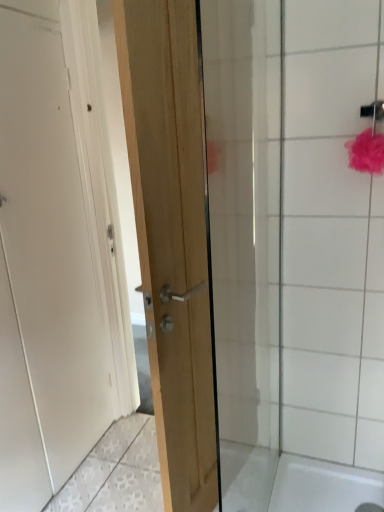
At what (x,y) coordinates should I click in order to perform the action: click on natural wood door at center, which ranks as the second door in left-to-right order. Please return your answer as a coordinate pair (x, y). The width and height of the screenshot is (384, 512). Looking at the image, I should click on (172, 234).

At what (x,y) coordinates should I click in order to perform the action: click on white matte door at left, the second door viewed from the right. Please return your answer as a coordinate pair (x, y). This screenshot has width=384, height=512. Looking at the image, I should click on (56, 234).

This screenshot has height=512, width=384. What do you see at coordinates (271, 260) in the screenshot?
I see `white glossy shower door at upper right` at bounding box center [271, 260].

You are a GUI agent. You are given a task and a screenshot of the screen. Output one action in this format:
    pyautogui.click(x=<x>, y=<y>)
    Task: Click on the natural wood door at center, marked as the 1th door in a right-to-left arrangement
    The width and height of the screenshot is (384, 512).
    Given the screenshot: What is the action you would take?
    pyautogui.click(x=172, y=234)

Is white glossy shower door at upper right positioned in front of natural wood door at center, which ranks as the second door in left-to-right order?

No, white glossy shower door at upper right is behind natural wood door at center, which ranks as the second door in left-to-right order.

The height and width of the screenshot is (512, 384). In order to click on shower door behind the natural wood door at center, which ranks as the second door in left-to-right order in this screenshot , I will do `click(271, 260)`.

Is point (313, 106) closer to camera compared to point (201, 69)?

No, (313, 106) is further to viewer.

Is white matte door at left, the second door viewed from the right, positioned with its back to white glossy shower door at upper right?

white matte door at left, the second door viewed from the right, is not turned away from white glossy shower door at upper right.

From the image's perspective, is white matte door at left, the 1th door from the left, located above or below white glossy shower door at upper right?

white matte door at left, the 1th door from the left, is situated higher than white glossy shower door at upper right in the image.

Between white matte door at left, the second door viewed from the right, and white glossy shower door at upper right, which one has smaller size?

white glossy shower door at upper right is smaller.

Can you confirm if white matte door at left, the second door viewed from the right, is positioned to the right of white glossy shower door at upper right?

No.

Could you tell me if natural wood door at center, which ranks as the second door in left-to-right order, is facing white matte door at left, the 1th door from the left?

Yes, natural wood door at center, which ranks as the second door in left-to-right order, is aimed at white matte door at left, the 1th door from the left.

The height and width of the screenshot is (512, 384). I want to click on door above the natural wood door at center, marked as the 1th door in a right-to-left arrangement (from the image's perspective), so click(x=56, y=234).

Considering the sizes of natural wood door at center, which ranks as the second door in left-to-right order, and white matte door at left, the 1th door from the left, in the image, is natural wood door at center, which ranks as the second door in left-to-right order, taller or shorter than white matte door at left, the 1th door from the left,?

In the image, natural wood door at center, which ranks as the second door in left-to-right order, appears to be shorter than white matte door at left, the 1th door from the left.

Which of these two, natural wood door at center, which ranks as the second door in left-to-right order, or white glossy shower door at upper right, is bigger?

natural wood door at center, which ranks as the second door in left-to-right order, is bigger.

Considering the sizes of natural wood door at center, which ranks as the second door in left-to-right order, and white glossy shower door at upper right in the image, is natural wood door at center, which ranks as the second door in left-to-right order, taller or shorter than white glossy shower door at upper right?

Considering their sizes, natural wood door at center, which ranks as the second door in left-to-right order, has more height than white glossy shower door at upper right.

Can you tell me how much natural wood door at center, which ranks as the second door in left-to-right order, and white glossy shower door at upper right differ in facing direction?

They differ by 99.9 degrees in their facing directions.

Is natural wood door at center, which ranks as the second door in left-to-right order, positioned beyond the bounds of white glossy shower door at upper right?

Absolutely, natural wood door at center, which ranks as the second door in left-to-right order, is external to white glossy shower door at upper right.

Is white matte door at left, the second door viewed from the right, looking in the opposite direction of natural wood door at center, which ranks as the second door in left-to-right order?

Absolutely, white matte door at left, the second door viewed from the right, is directed away from natural wood door at center, which ranks as the second door in left-to-right order.

In the image, is white matte door at left, the 1th door from the left, positioned in front of or behind natural wood door at center, marked as the 1th door in a right-to-left arrangement?

white matte door at left, the 1th door from the left, is behind natural wood door at center, marked as the 1th door in a right-to-left arrangement.

Can you confirm if white matte door at left, the second door viewed from the right, is smaller than natural wood door at center, marked as the 1th door in a right-to-left arrangement?

Incorrect, white matte door at left, the second door viewed from the right, is not smaller in size than natural wood door at center, marked as the 1th door in a right-to-left arrangement.

Is white matte door at left, the second door viewed from the right, taller or shorter than natural wood door at center, marked as the 1th door in a right-to-left arrangement?

white matte door at left, the second door viewed from the right, is taller than natural wood door at center, marked as the 1th door in a right-to-left arrangement.

Between white glossy shower door at upper right and white matte door at left, the 1th door from the left, which one has less height?

white glossy shower door at upper right is shorter.

Would you say white glossy shower door at upper right is a long distance from white matte door at left, the second door viewed from the right?

They are positioned close to each other.

Between point (267, 231) and point (97, 276), which one is positioned behind?

The point (97, 276) is more distant.

Is white glossy shower door at upper right aimed at white matte door at left, the 1th door from the left?

No, white glossy shower door at upper right is not turned towards white matte door at left, the 1th door from the left.

Starting from the white glossy shower door at upper right, which door is the 2nd one in front? Please provide its 2D coordinates.

[(172, 234)]

Locate an element on the screen. The image size is (384, 512). shower door on the right of white matte door at left, the second door viewed from the right is located at coordinates (271, 260).

Estimate the real-world distances between objects in this image. Which object is closer to natural wood door at center, which ranks as the second door in left-to-right order, white glossy shower door at upper right or white matte door at left, the 1th door from the left?

white glossy shower door at upper right lies closer to natural wood door at center, which ranks as the second door in left-to-right order, than the other object.

Considering their positions, is white matte door at left, the second door viewed from the right, positioned further to natural wood door at center, which ranks as the second door in left-to-right order, than white glossy shower door at upper right?

Among the two, white matte door at left, the second door viewed from the right, is located further to natural wood door at center, which ranks as the second door in left-to-right order.

Considering their positions, is natural wood door at center, marked as the 1th door in a right-to-left arrangement, positioned closer to white matte door at left, the 1th door from the left, than white glossy shower door at upper right?

natural wood door at center, marked as the 1th door in a right-to-left arrangement.

Looking at the image, which one is located closer to white glossy shower door at upper right, white matte door at left, the 1th door from the left, or natural wood door at center, marked as the 1th door in a right-to-left arrangement?

The object closer to white glossy shower door at upper right is natural wood door at center, marked as the 1th door in a right-to-left arrangement.

Looking at the image, which one is located closer to white matte door at left, the 1th door from the left, white glossy shower door at upper right or natural wood door at center, marked as the 1th door in a right-to-left arrangement?

Among the two, natural wood door at center, marked as the 1th door in a right-to-left arrangement, is located nearer to white matte door at left, the 1th door from the left.

Based on their spatial positions, is natural wood door at center, which ranks as the second door in left-to-right order, or white matte door at left, the second door viewed from the right, closer to white glossy shower door at upper right?

natural wood door at center, which ranks as the second door in left-to-right order, is closer to white glossy shower door at upper right.

Image resolution: width=384 pixels, height=512 pixels. I want to click on door between white matte door at left, the 1th door from the left, and white glossy shower door at upper right, in the horizontal direction, so click(x=172, y=234).